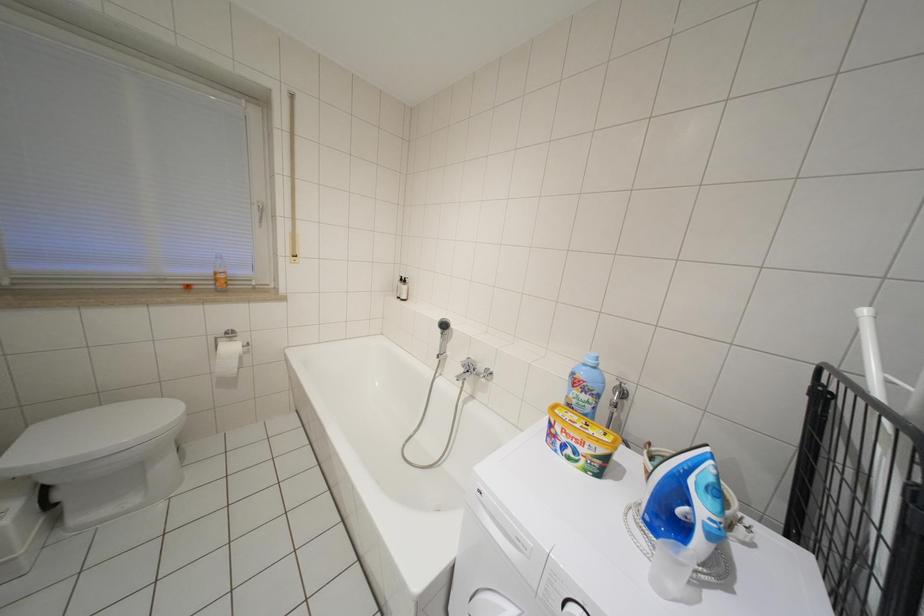
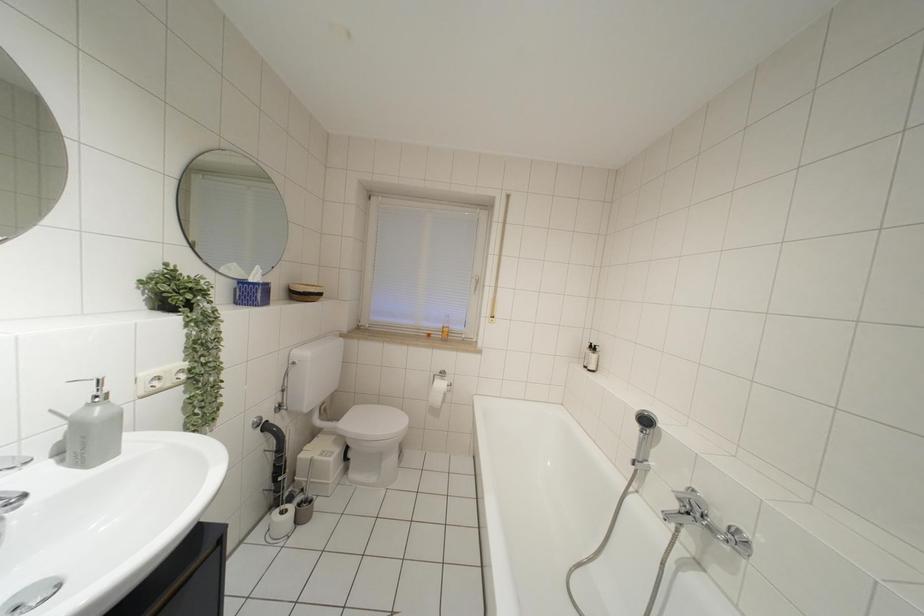
Question: The camera is either moving clockwise (left) or counter-clockwise (right) around the object. The first image is from the beginning of the video and the second image is from the end. Is the camera moving left or right when shooting the video?

Choices:
 (A) Left
 (B) Right

Answer: (B)